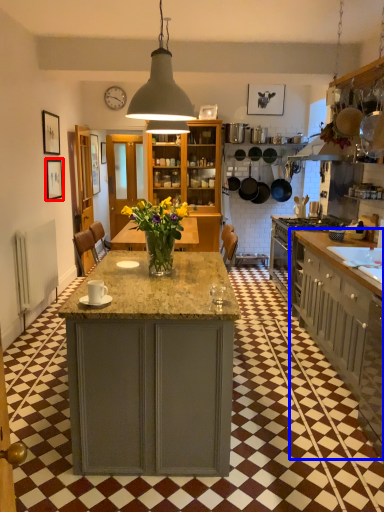
Question: Among these objects, which one is nearest to the camera, picture frame (highlighted by a red box) or cabinetry (highlighted by a blue box)?

Choices:
 (A) picture frame
 (B) cabinetry

Answer: (B)